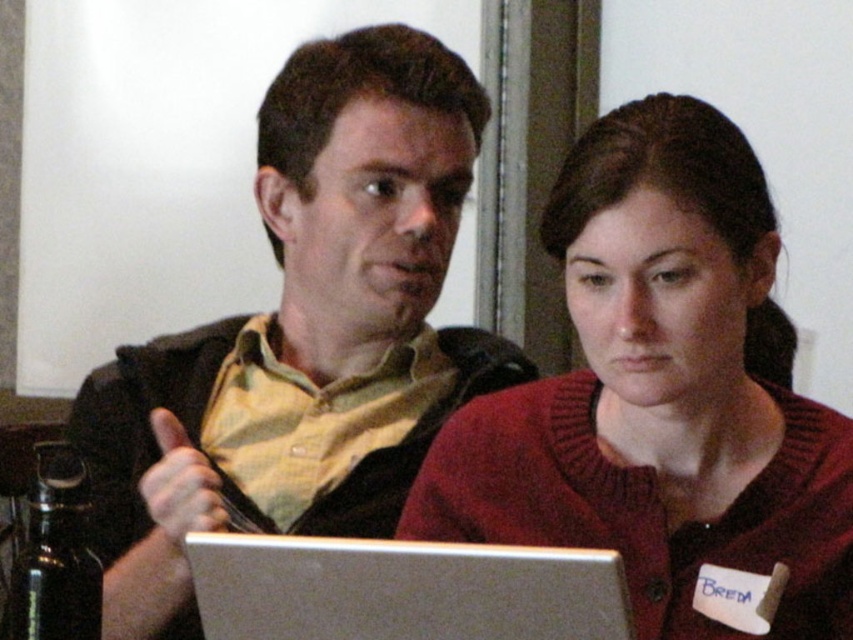
You are a person who needs to maintain a social distance of at least 6 feet. You are standing at the point marked by the coordinate point at point [432,225]. Can you safely interact with the person on the right without violating the social distance requirement?

The two individuals are 3.91 feet apart, which is less than the required 6 feet for social distancing. Therefore, you cannot safely interact with the person on the right without violating the social distance requirement.

You are organizing a tech conference and need to set up two laptops for a presentation. The matte black laptop at center and the silver metallic laptop at center must be placed on a table that can only accommodate one of them. Which laptop should you choose to ensure it fits properly?

The silver metallic laptop at center is smaller in size compared to the matte black laptop at center, so you should choose the silver metallic laptop at center to ensure it fits properly on the table.

You are an assistant who needs to hand a document to the person wearing the knitted red sweater at center. The document must be placed on the matte black laptop at center. Can you do this without moving the laptop?

The matte black laptop at center is located above the knitted red sweater at center, so yes, you can place the document on the matte black laptop at center without moving it since it is already positioned above the sweater.